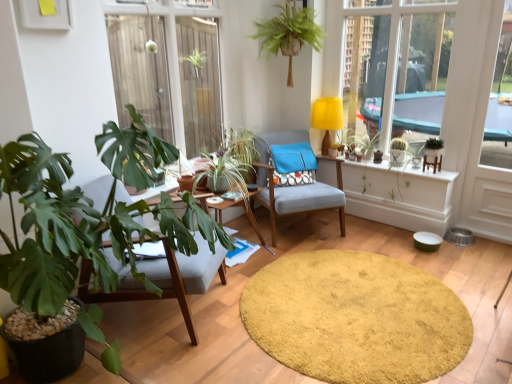
You are a GUI agent. You are given a task and a screenshot of the screen. Output one action in this format:
    pyautogui.click(x=<x>, y=<y>)
    Task: Click on the free space to the right of matte black pot at center
    The width and height of the screenshot is (512, 384).
    Given the screenshot: What is the action you would take?
    pyautogui.click(x=393, y=157)